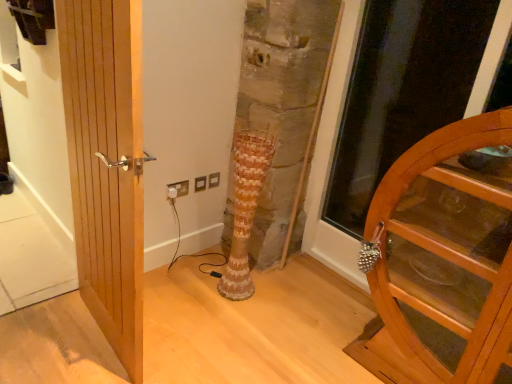
Question: Can you confirm if brown textured vase at center is thinner than natural wood door at left, the second door when ordered from right to left?

Choices:
 (A) yes
 (B) no

Answer: (B)

Question: Is brown textured vase at center positioned far away from natural wood door at left, the second door when ordered from right to left?

Choices:
 (A) yes
 (B) no

Answer: (B)

Question: Can you see brown textured vase at center touching natural wood door at left, the second door when ordered from right to left?

Choices:
 (A) no
 (B) yes

Answer: (A)

Question: Is brown textured vase at center positioned behind natural wood door at left, the second door when ordered from right to left?

Choices:
 (A) no
 (B) yes

Answer: (B)

Question: From a real-world perspective, is brown textured vase at center positioned over natural wood door at left, which is the first door from left to right, based on gravity?

Choices:
 (A) no
 (B) yes

Answer: (A)

Question: Based on their positions, is white plastic electric outlet at lower center located to the left or right of natural wood door at left, the second door when ordered from right to left?

Choices:
 (A) right
 (B) left

Answer: (A)

Question: Choose the correct answer: Is white plastic electric outlet at lower center inside natural wood door at left, which is the first door from left to right, or outside it?

Choices:
 (A) inside
 (B) outside

Answer: (B)

Question: Is point (175, 190) positioned closer to the camera than point (141, 221)?

Choices:
 (A) closer
 (B) farther

Answer: (B)

Question: Is white plastic electric outlet at lower center wider or thinner than natural wood door at left, which is the first door from left to right?

Choices:
 (A) wide
 (B) thin

Answer: (B)

Question: In terms of width, does transparent wooden door at right look wider or thinner when compared to brown textured vase at center?

Choices:
 (A) wide
 (B) thin

Answer: (A)

Question: Considering the positions of transparent wooden door at right and brown textured vase at center in the image, is transparent wooden door at right taller or shorter than brown textured vase at center?

Choices:
 (A) tall
 (B) short

Answer: (A)

Question: Does point [x=376, y=104] appear closer or farther from the camera than point [x=245, y=152]?

Choices:
 (A) closer
 (B) farther

Answer: (B)

Question: From the image's perspective, is transparent wooden door at right located above or below brown textured vase at center?

Choices:
 (A) below
 (B) above

Answer: (B)

Question: From a real-world perspective, is natural wood door at left, which is the first door from left to right, above or below transparent wooden door at right?

Choices:
 (A) below
 (B) above

Answer: (A)

Question: Is natural wood door at left, which is the first door from left to right, taller or shorter than transparent wooden door at right?

Choices:
 (A) short
 (B) tall

Answer: (A)